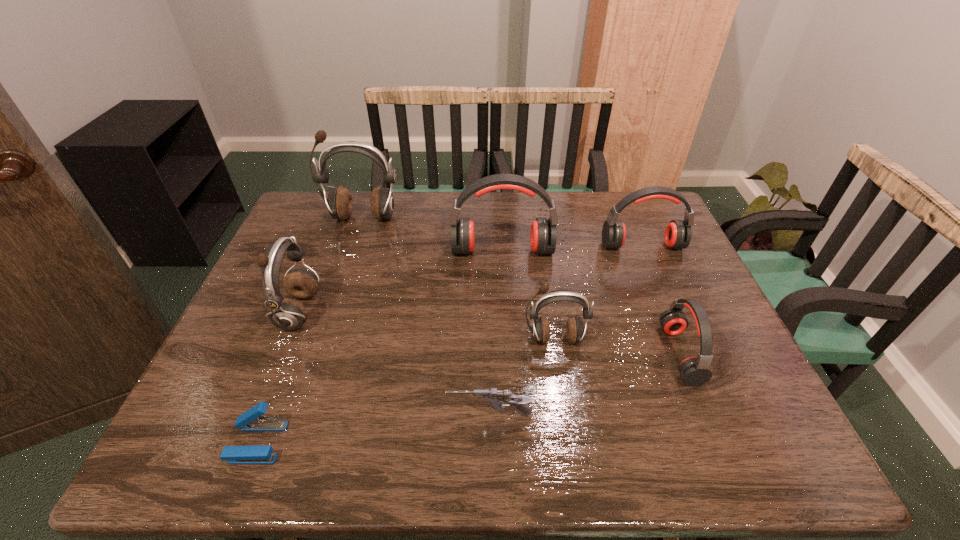
Find the location of a particular element. blue stapler is located at coordinates click(252, 420).

At what (x,y) coordinates should I click in order to perform the action: click on free region located on the ear pads of the farthest object. Please return your answer as a coordinate pair (x, y). The image size is (960, 540). Looking at the image, I should click on (340, 285).

Where is `vacant region located on the ear cups of the biggest red earphone`? This screenshot has width=960, height=540. vacant region located on the ear cups of the biggest red earphone is located at coordinates (505, 296).

Find the location of a particular element. vacant region located on the ear pads of the second smallest brown earphone is located at coordinates (421, 313).

You are a GUI agent. You are given a task and a screenshot of the screen. Output one action in this format:
    pyautogui.click(x=<x>, y=<y>)
    Task: Click on the vacant space located on the ear cups of the second smallest red earphone
    The width and height of the screenshot is (960, 540).
    Given the screenshot: What is the action you would take?
    pyautogui.click(x=675, y=323)

Where is `free location located 0.240m on the ear pads of the smallest brown earphone`? free location located 0.240m on the ear pads of the smallest brown earphone is located at coordinates (571, 447).

Locate an element on the screen. The height and width of the screenshot is (540, 960). vacant space positioned 0.050m on the ear cups of the smallest red earphone is located at coordinates (645, 354).

Where is `vacant space located on the ear cups of the smallest red earphone`? vacant space located on the ear cups of the smallest red earphone is located at coordinates (540, 354).

Identify the location of free spot located on the ear cups of the smallest red earphone. (612, 354).

Locate an element on the screen. This screenshot has height=540, width=960. vacant region located 0.090m at the barrel of the seventh farthest object is located at coordinates (404, 415).